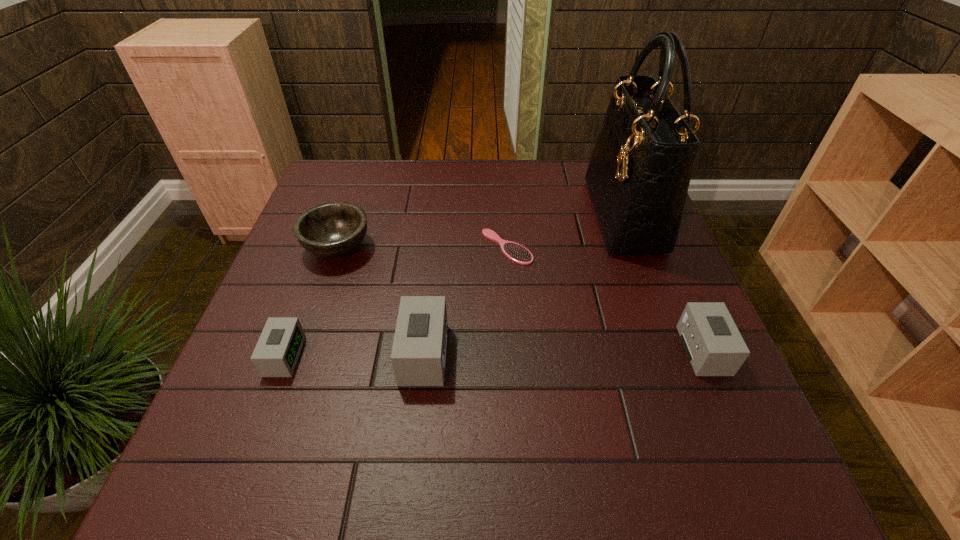
Locate an element on the screen. The width and height of the screenshot is (960, 540). vacant region between the second shortest alarm clock and the third object from right to left is located at coordinates coord(605,299).

Where is `vacant region between the leftmost alarm clock and the shortest object`? vacant region between the leftmost alarm clock and the shortest object is located at coordinates (396, 301).

At what (x,y) coordinates should I click in order to perform the action: click on unoccupied area between the second alarm clock from right to left and the handbag. Please return your answer as a coordinate pair (x, y). The width and height of the screenshot is (960, 540). Looking at the image, I should click on (524, 285).

Locate an element on the screen. free space between the leftmost alarm clock and the fourth object from left to right is located at coordinates (396, 301).

Where is `vacant area between the bowl and the handbag`? vacant area between the bowl and the handbag is located at coordinates (481, 231).

Locate an element on the screen. This screenshot has height=540, width=960. empty space that is in between the second shortest object and the fourth object from left to right is located at coordinates [396, 301].

The width and height of the screenshot is (960, 540). Identify the location of free point between the shortest object and the rightmost alarm clock. (605, 299).

Identify the location of empty space that is in between the shortest alarm clock and the tallest object. (454, 286).

Locate which object ranks fifth in proximity to the hairbrush. Please provide its 2D coordinates. Your answer should be formatted as a tuple, i.e. [(x, y)], where the tuple contains the x and y coordinates of a point satisfying the conditions above.

[(277, 351)]

Select which object appears as the second closest to the second shortest alarm clock. Please provide its 2D coordinates. Your answer should be formatted as a tuple, i.e. [(x, y)], where the tuple contains the x and y coordinates of a point satisfying the conditions above.

[(517, 253)]